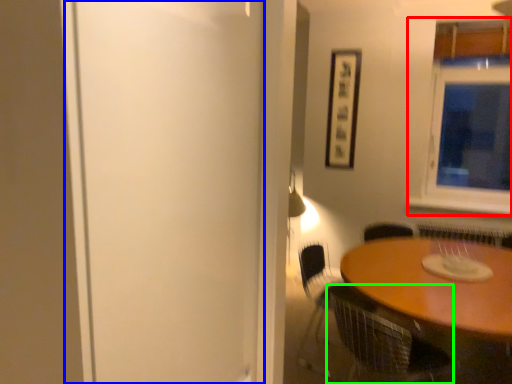
Question: Which object is positioned closest to window (highlighted by a red box)? Select from screen door (highlighted by a blue box) and chair (highlighted by a green box).

Choices:
 (A) screen door
 (B) chair

Answer: (B)